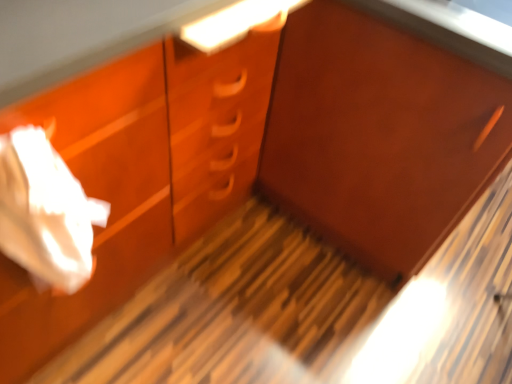
Question: Would you consider white paper at left to be distant from matte wood cabinet at center?

Choices:
 (A) no
 (B) yes

Answer: (A)

Question: Is white paper at left with matte wood cabinet at center?

Choices:
 (A) yes
 (B) no

Answer: (B)

Question: Could matte wood cabinet at center be considered to be inside white paper at left?

Choices:
 (A) no
 (B) yes

Answer: (A)

Question: Can you confirm if white paper at left is wider than matte wood cabinet at center?

Choices:
 (A) yes
 (B) no

Answer: (B)

Question: Is white paper at left positioned with its back to matte wood cabinet at center?

Choices:
 (A) no
 (B) yes

Answer: (A)

Question: Does white paper at left have a lesser width compared to matte wood cabinet at center?

Choices:
 (A) yes
 (B) no

Answer: (A)

Question: Does matte wood cabinet at center appear on the left side of white paper at left?

Choices:
 (A) no
 (B) yes

Answer: (A)

Question: Is matte wood cabinet at center oriented towards white paper at left?

Choices:
 (A) no
 (B) yes

Answer: (B)

Question: Is white paper at left at the back of matte wood cabinet at center?

Choices:
 (A) no
 (B) yes

Answer: (A)

Question: Considering the relative positions of matte wood cabinet at center and white paper at left in the image provided, is matte wood cabinet at center to the right of white paper at left from the viewer's perspective?

Choices:
 (A) yes
 (B) no

Answer: (A)

Question: Is matte wood cabinet at center wider than white paper at left?

Choices:
 (A) no
 (B) yes

Answer: (B)

Question: Is the surface of matte wood cabinet at center in direct contact with white paper at left?

Choices:
 (A) no
 (B) yes

Answer: (A)

Question: Does point (334, 142) appear closer or farther from the camera than point (123, 198)?

Choices:
 (A) closer
 (B) farther

Answer: (B)